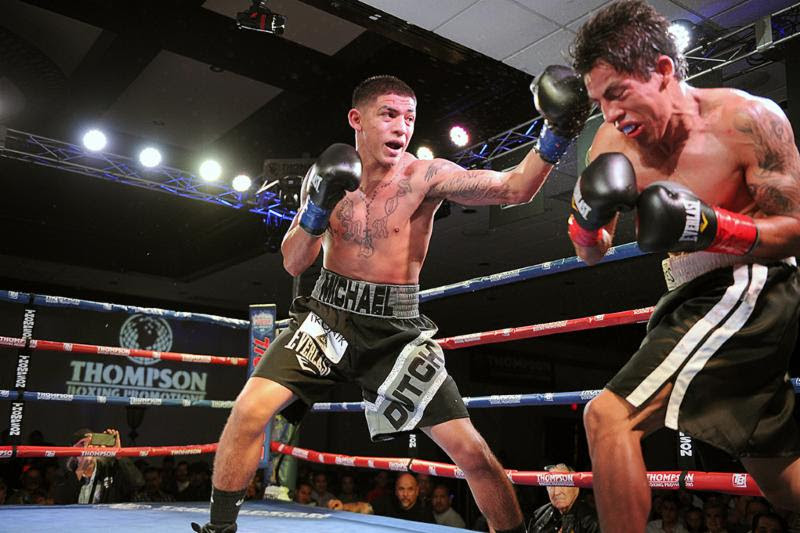
I want to click on lights attached to rafters, so 242,181, 206,163, 154,156, 96,145, 469,132, 426,145, 692,31.